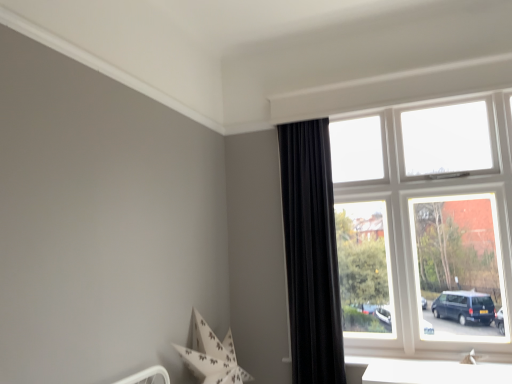
Question: Considering the positions of white frame window at upper right and black velvet curtain at right in the image, is white frame window at upper right taller or shorter than black velvet curtain at right?

Choices:
 (A) tall
 (B) short

Answer: (B)

Question: Is point (407, 248) closer or farther from the camera than point (301, 327)?

Choices:
 (A) closer
 (B) farther

Answer: (B)

Question: Would you say white frame window at upper right is inside or outside black velvet curtain at right?

Choices:
 (A) outside
 (B) inside

Answer: (A)

Question: Is point (301, 261) positioned closer to the camera than point (337, 185)?

Choices:
 (A) farther
 (B) closer

Answer: (B)

Question: Based on their sizes in the image, would you say black velvet curtain at right is bigger or smaller than white frame window at upper right?

Choices:
 (A) small
 (B) big

Answer: (A)

Question: Looking at their shapes, would you say black velvet curtain at right is wider or thinner than white frame window at upper right?

Choices:
 (A) thin
 (B) wide

Answer: (B)

Question: Is black velvet curtain at right to the left or to the right of white frame window at upper right in the image?

Choices:
 (A) left
 (B) right

Answer: (A)